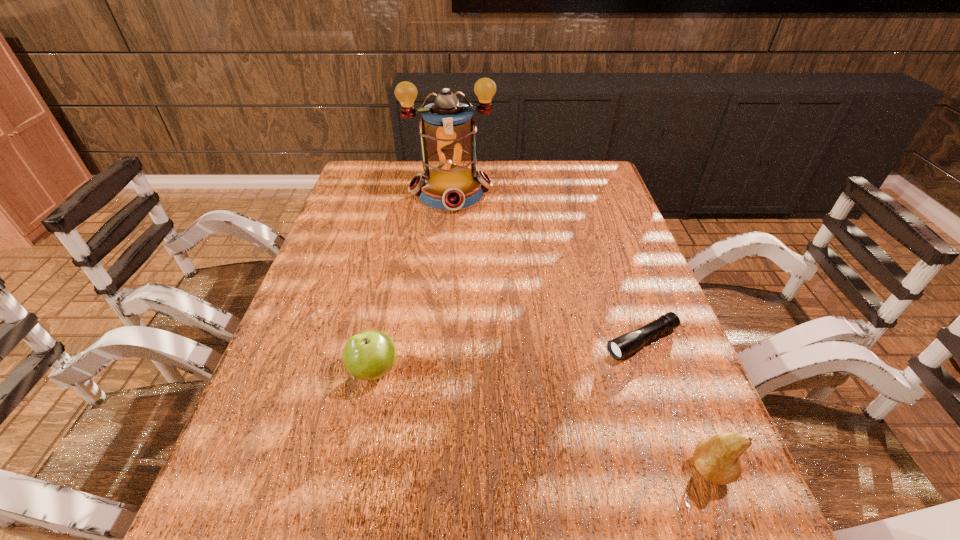
Image resolution: width=960 pixels, height=540 pixels. I want to click on free space located 0.340m at the lens end of the flashlight, so click(x=478, y=423).

At what (x,y) coordinates should I click in order to perform the action: click on free space located at the lens end of the flashlight. Please return your answer as a coordinate pair (x, y). Looking at the image, I should click on (553, 383).

The image size is (960, 540). Identify the location of vacant space situated 0.260m at the lens end of the flashlight. 513,404.

This screenshot has height=540, width=960. I want to click on object that is at the far edge, so click(x=447, y=132).

Find the location of a particular element. This screenshot has height=540, width=960. object that is at the near edge is located at coordinates (718, 458).

At what (x,y) coordinates should I click in order to perform the action: click on pear present at the right edge. Please return your answer as a coordinate pair (x, y). Image resolution: width=960 pixels, height=540 pixels. Looking at the image, I should click on (718, 458).

Find the location of a particular element. The width and height of the screenshot is (960, 540). flashlight present at the right edge is located at coordinates (624, 345).

Locate an element on the screen. This screenshot has width=960, height=540. object present at the near right corner is located at coordinates pyautogui.click(x=718, y=458).

At what (x,y) coordinates should I click in order to perform the action: click on vacant space at the far edge. Please return your answer as a coordinate pair (x, y). This screenshot has width=960, height=540. Looking at the image, I should click on (560, 189).

At what (x,y) coordinates should I click in order to perform the action: click on vacant region at the left edge of the desktop. Please return your answer as a coordinate pair (x, y). Looking at the image, I should click on (271, 422).